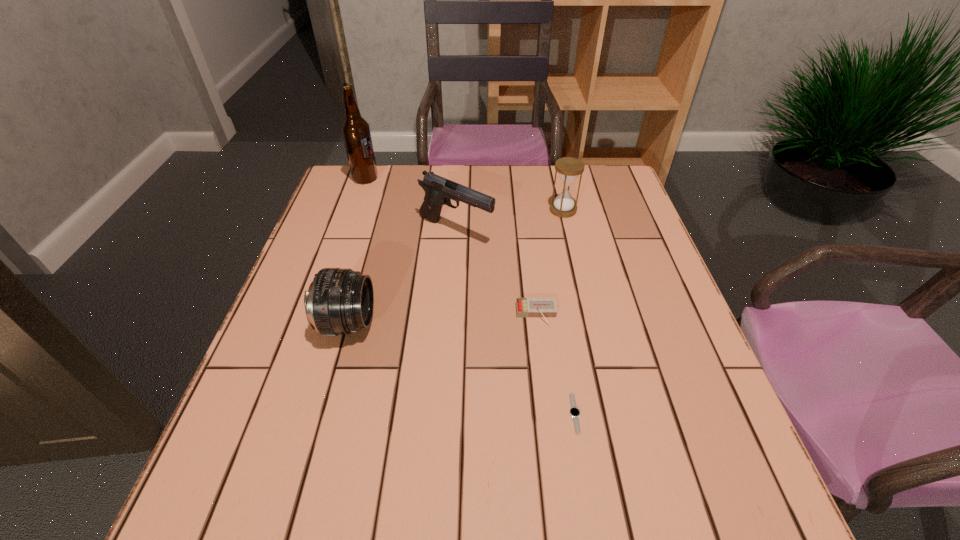
Where is `the farthest object`? the farthest object is located at coordinates (356, 133).

Where is `beer bottle`? beer bottle is located at coordinates (356, 133).

Identify the location of gun. This screenshot has width=960, height=540. (439, 191).

The image size is (960, 540). Identify the location of the rightmost object. (568, 168).

At what (x,y) coordinates should I click in order to perform the action: click on telephoto lens. Please return your answer as a coordinate pair (x, y). The width and height of the screenshot is (960, 540). Looking at the image, I should click on (339, 301).

At what (x,y) coordinates should I click in order to perform the action: click on the second shortest object. Please return your answer as a coordinate pair (x, y). The image size is (960, 540). Looking at the image, I should click on (545, 308).

Locate an element on the screen. This screenshot has height=540, width=960. the shortest object is located at coordinates (574, 412).

Locate an element on the screen. Image resolution: width=960 pixels, height=540 pixels. the nearest object is located at coordinates (574, 412).

At what (x,y) coordinates should I click in order to perform the action: click on free space located 0.260m on the label of the beer bottle. Please return your answer as a coordinate pair (x, y). This screenshot has width=960, height=540. Looking at the image, I should click on (461, 179).

Locate an element on the screen. vacant region located at the muzzle of the fourth object from right to left is located at coordinates (516, 231).